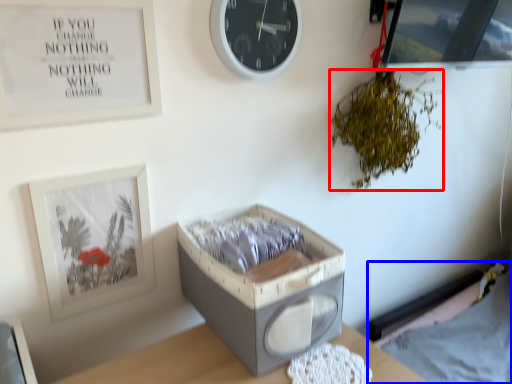
Question: Which object is further to the camera taking this photo, plant (highlighted by a red box) or hospital bed (highlighted by a blue box)?

Choices:
 (A) plant
 (B) hospital bed

Answer: (B)